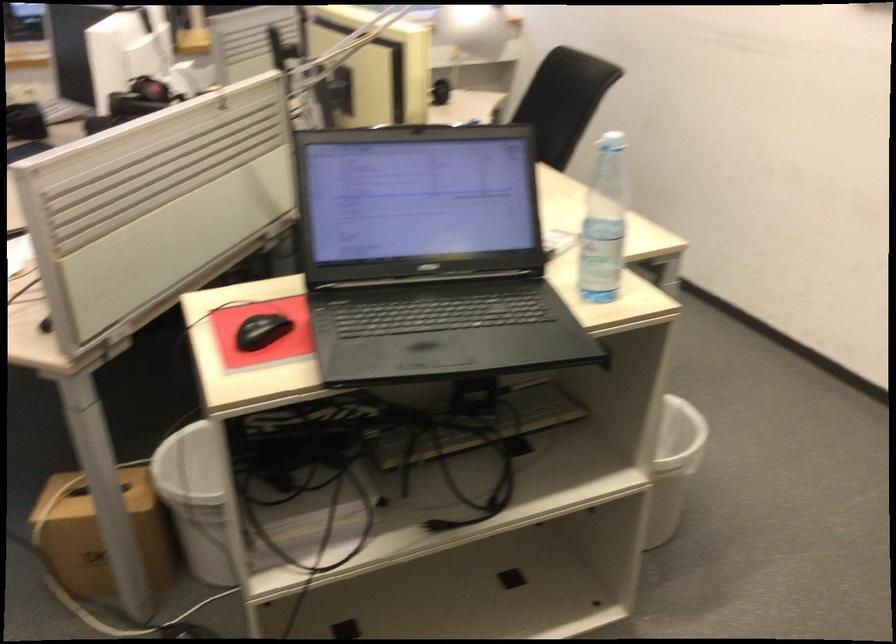
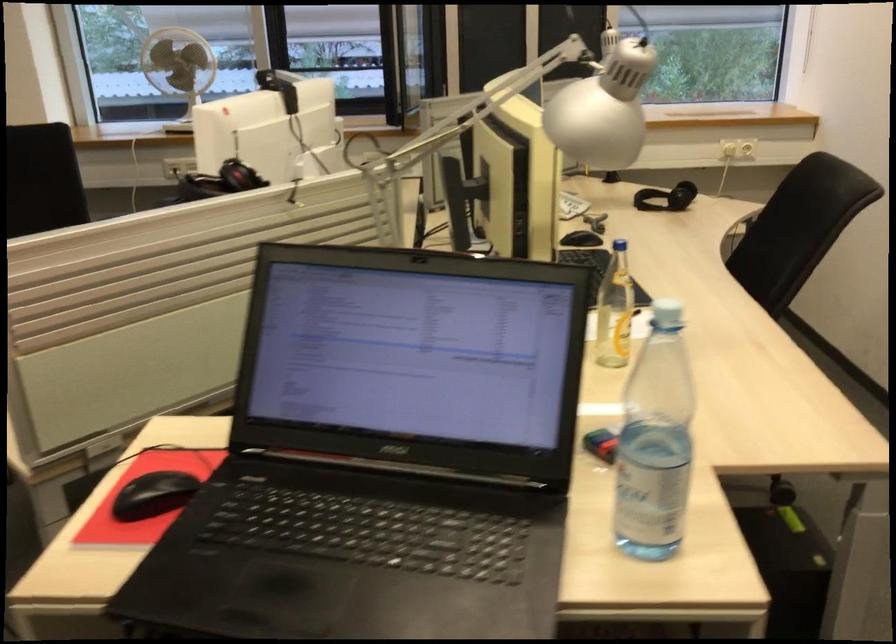
Find the pixel in the second image that matches [609,136] in the first image.

(666, 313)